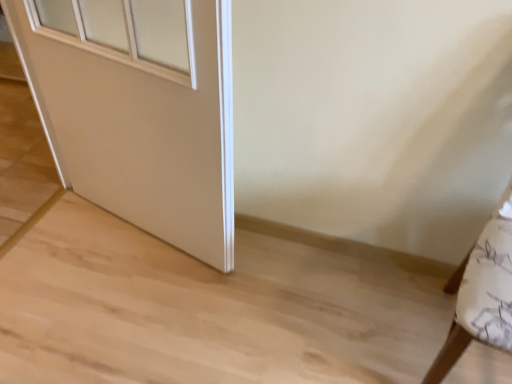
At what (x,y) coordinates should I click in order to perform the action: click on white matte door at center. Please return your answer as a coordinate pair (x, y). The width and height of the screenshot is (512, 384). Looking at the image, I should click on (139, 110).

What is the approximate width of white matte door at center?

The width of white matte door at center is 8.49 inches.

What do you see at coordinates (139, 110) in the screenshot? This screenshot has width=512, height=384. I see `white matte door at center` at bounding box center [139, 110].

This screenshot has width=512, height=384. What do you see at coordinates (481, 293) in the screenshot? I see `white fabric cushion at right` at bounding box center [481, 293].

At what (x,y) coordinates should I click in order to perform the action: click on white fabric cushion at right. Please return your answer as a coordinate pair (x, y). Image resolution: width=512 pixels, height=384 pixels. Looking at the image, I should click on (481, 293).

In order to face white fabric cushion at right, should I rotate leftwards or rightwards?

Turn right approximately 31.306 degrees to face it.

Locate an element on the screen. white matte door at center is located at coordinates [139, 110].

Considering the relative positions of white fabric cushion at right and white matte door at center in the image provided, is white fabric cushion at right to the right of white matte door at center from the viewer's perspective?

Correct, you'll find white fabric cushion at right to the right of white matte door at center.

Is white fabric cushion at right in front of white matte door at center?

Yes, it is.

Between point (464, 294) and point (82, 20), which one is positioned behind?

Positioned behind is point (82, 20).

From the image's perspective, would you say white fabric cushion at right is shown under white matte door at center?

Indeed, from the image's perspective, white fabric cushion at right is shown beneath white matte door at center.

From a real-world perspective, which object rests below the other?

white fabric cushion at right, from a real-world perspective.

Can you confirm if white fabric cushion at right is thinner than white matte door at center?

Incorrect, the width of white fabric cushion at right is not less than that of white matte door at center.

Is white fabric cushion at right taller or shorter than white matte door at center?

white fabric cushion at right is shorter than white matte door at center.

Who is smaller, white fabric cushion at right or white matte door at center?

white fabric cushion at right.

Is white fabric cushion at right inside or outside of white matte door at center?

The correct answer is: outside.

Is white fabric cushion at right next to white matte door at center and touching it?

white fabric cushion at right and white matte door at center are not in contact.

Is white matte door at center at the back of white fabric cushion at right?

white fabric cushion at right is not turned away from white matte door at center.

Locate an element on the screen. The height and width of the screenshot is (384, 512). furniture located underneath the white matte door at center (from a real-world perspective) is located at coordinates (481, 293).

Between white matte door at center and white fabric cushion at right, which one appears on the left side from the viewer's perspective?

white matte door at center.

Which object is further away from the camera taking this photo, white matte door at center or white fabric cushion at right?

white matte door at center is further from the camera.

Which is closer to the camera, [163,232] or [495,316]?

The point [495,316] is closer to the camera.

From the image's perspective, which is above, white matte door at center or white fabric cushion at right?

From the image's view, white matte door at center is above.

From a real-world perspective, which object rests below the other?

white fabric cushion at right, from a real-world perspective.

Between white matte door at center and white fabric cushion at right, which one has larger width?

Wider between the two is white fabric cushion at right.

Considering the relative sizes of white matte door at center and white fabric cushion at right in the image provided, is white matte door at center shorter than white fabric cushion at right?

No, white matte door at center is not shorter than white fabric cushion at right.

Is white matte door at center smaller than white fabric cushion at right?

No.

From the picture: Is white fabric cushion at right surrounded by white matte door at center?

No, white fabric cushion at right is not inside white matte door at center.

Is white matte door at center next to white fabric cushion at right and touching it?

No, white matte door at center is not with white fabric cushion at right.

Is white matte door at center facing towards white fabric cushion at right?

No, white matte door at center is not turned towards white fabric cushion at right.

What's the angular difference between white matte door at center and white fabric cushion at right's facing directions?

white matte door at center and white fabric cushion at right are facing 3.23 degrees away from each other.

How far apart are white matte door at center and white fabric cushion at right?

white matte door at center and white fabric cushion at right are 1.06 meters apart from each other.

Image resolution: width=512 pixels, height=384 pixels. I want to click on furniture that is in front of the white matte door at center, so click(x=481, y=293).

In order to click on furniture below the white matte door at center (from a real-world perspective) in this screenshot , I will do `click(481, 293)`.

This screenshot has height=384, width=512. Identify the location of door above the white fabric cushion at right (from the image's perspective). (139, 110).